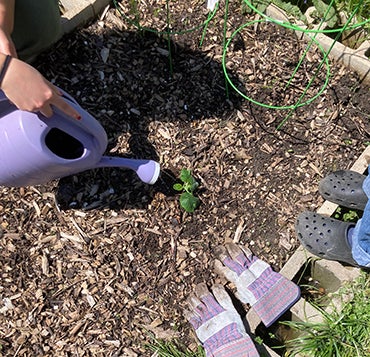
I want to click on baby plant, so click(189, 187).